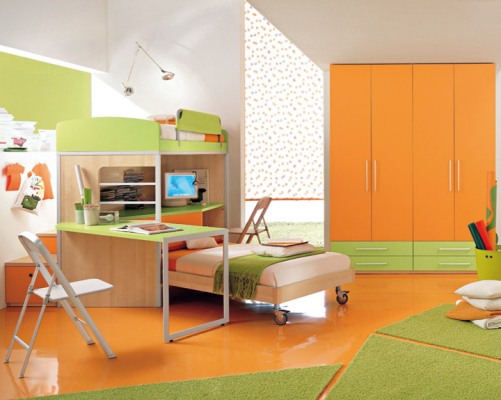
Find the location of a particular element. folding chair is located at coordinates (61, 291), (262, 205).